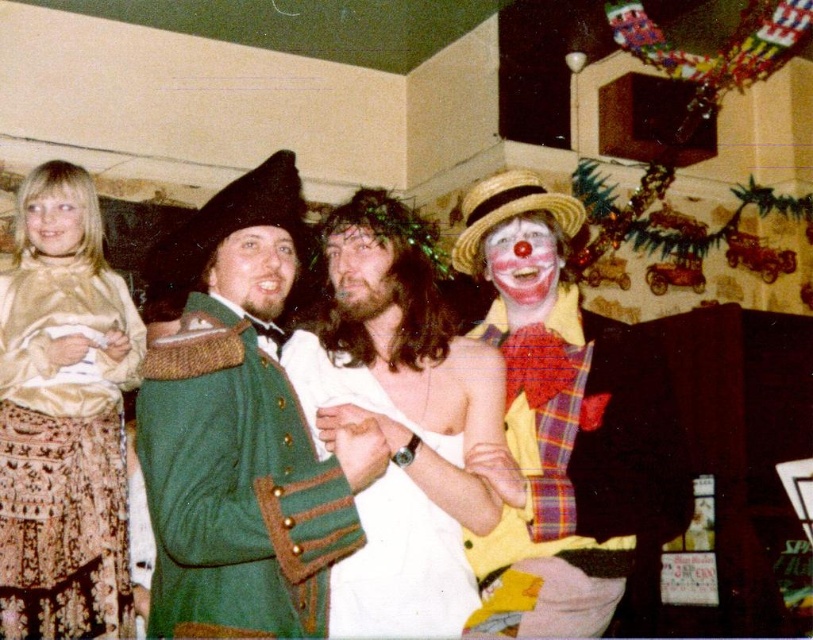
Question: Which of the following is the farthest from the observer?

Choices:
 (A) (412, 563)
 (B) (379, 243)
 (C) (233, 230)
 (D) (42, 216)

Answer: (D)

Question: Among these objects, which one is nearest to the camera?

Choices:
 (A) gold satin blouse at left
 (B) green woolen coat at center

Answer: (B)

Question: Which object appears farthest from the camera in this image?

Choices:
 (A) matte yellow clown nose at center
 (B) blonde hair at left
 (C) white fabric shirt at center

Answer: (B)

Question: Observing the image, what is the correct spatial positioning of matte green vest at center in reference to shaggy brown hair at center?

Choices:
 (A) above
 (B) below

Answer: (B)

Question: Can you confirm if matte yellow clown nose at center is bigger than matte clown face at center?

Choices:
 (A) yes
 (B) no

Answer: (A)

Question: Can you confirm if matte green vest at center is positioned below blonde hair at left?

Choices:
 (A) yes
 (B) no

Answer: (A)